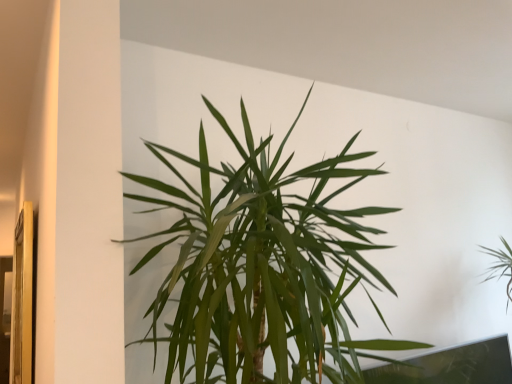
The image size is (512, 384). What are the coordinates of `green leafy plant at upper right, positioned as the first houseplant in back-to-front order` in the screenshot? It's located at (500, 266).

Describe the element at coordinates (500, 266) in the screenshot. Image resolution: width=512 pixels, height=384 pixels. I see `green leafy plant at upper right, the 2th houseplant viewed from the left` at that location.

Describe the element at coordinates (262, 267) in the screenshot. This screenshot has height=384, width=512. I see `green leafy plant at center, arranged as the 2th houseplant when viewed from the right` at that location.

At what (x,y) coordinates should I click in order to perform the action: click on green leafy plant at center, marked as the 1th houseplant in a front-to-back arrangement. Please return your answer as a coordinate pair (x, y). Looking at the image, I should click on (262, 267).

Find the location of `green leafy plant at upper right, the 2th houseplant when ordered from front to back`. green leafy plant at upper right, the 2th houseplant when ordered from front to back is located at coordinates (500, 266).

Would you say green leafy plant at upper right, the 2th houseplant when ordered from front to back, is to the left or to the right of green leafy plant at center, arranged as the 1th houseplant when viewed from the left, in the picture?

green leafy plant at upper right, the 2th houseplant when ordered from front to back, is positioned on green leafy plant at center, arranged as the 1th houseplant when viewed from the left,'s right side.

Is green leafy plant at upper right, the first houseplant in the right-to-left sequence, further to the viewer compared to green leafy plant at center, arranged as the 1th houseplant when viewed from the left?

Yes, it is.

Is point (507, 247) positioned after point (247, 121)?

Yes, it is behind point (247, 121).

In the scene shown: From the image's perspective, does green leafy plant at upper right, the first houseplant in the right-to-left sequence, appear lower than green leafy plant at center, arranged as the 2th houseplant when viewed from the right?

Yes.

From a real-world perspective, is green leafy plant at upper right, the 2th houseplant when ordered from front to back, beneath green leafy plant at center, arranged as the 1th houseplant when viewed from the left?

Yes, from a real-world perspective, green leafy plant at upper right, the 2th houseplant when ordered from front to back, is under green leafy plant at center, arranged as the 1th houseplant when viewed from the left.

Does green leafy plant at upper right, positioned as the first houseplant in back-to-front order, have a lesser width compared to green leafy plant at center, placed as the 2th houseplant when sorted from back to front?

Yes.

Considering the sizes of objects green leafy plant at upper right, the 2th houseplant when ordered from front to back, and green leafy plant at center, placed as the 2th houseplant when sorted from back to front, in the image provided, who is shorter, green leafy plant at upper right, the 2th houseplant when ordered from front to back, or green leafy plant at center, placed as the 2th houseplant when sorted from back to front,?

Standing shorter between the two is green leafy plant at upper right, the 2th houseplant when ordered from front to back.

Which of these two, green leafy plant at upper right, the first houseplant in the right-to-left sequence, or green leafy plant at center, arranged as the 2th houseplant when viewed from the right, is bigger?

Bigger between the two is green leafy plant at center, arranged as the 2th houseplant when viewed from the right.

Looking at this image, choose the correct answer: Is green leafy plant at upper right, the 2th houseplant when ordered from front to back, inside green leafy plant at center, arranged as the 1th houseplant when viewed from the left, or outside it?

green leafy plant at upper right, the 2th houseplant when ordered from front to back, lies outside green leafy plant at center, arranged as the 1th houseplant when viewed from the left.

Is green leafy plant at upper right, the 2th houseplant when ordered from front to back, placed right next to green leafy plant at center, arranged as the 1th houseplant when viewed from the left?

No, green leafy plant at upper right, the 2th houseplant when ordered from front to back, is not next to green leafy plant at center, arranged as the 1th houseplant when viewed from the left.

Consider the image. Is green leafy plant at upper right, the 2th houseplant when ordered from front to back, aimed at green leafy plant at center, arranged as the 2th houseplant when viewed from the right?

No.

How distant is green leafy plant at upper right, the first houseplant in the right-to-left sequence, from green leafy plant at center, arranged as the 1th houseplant when viewed from the left?

A distance of 1.98 meters exists between green leafy plant at upper right, the first houseplant in the right-to-left sequence, and green leafy plant at center, arranged as the 1th houseplant when viewed from the left.

The width and height of the screenshot is (512, 384). What are the coordinates of `houseplant in front of the green leafy plant at upper right, the 2th houseplant viewed from the left` in the screenshot? It's located at (262, 267).

Considering the positions of objects green leafy plant at center, arranged as the 2th houseplant when viewed from the right, and green leafy plant at upper right, the 2th houseplant when ordered from front to back, in the image provided, who is more to the left, green leafy plant at center, arranged as the 2th houseplant when viewed from the right, or green leafy plant at upper right, the 2th houseplant when ordered from front to back,?

Positioned to the left is green leafy plant at center, arranged as the 2th houseplant when viewed from the right.

Between green leafy plant at center, placed as the 2th houseplant when sorted from back to front, and green leafy plant at upper right, the 2th houseplant viewed from the left, which one is positioned behind?

green leafy plant at upper right, the 2th houseplant viewed from the left, is further from the camera.

Which is behind, point (263, 340) or point (507, 256)?

Positioned behind is point (507, 256).

From the image's perspective, which one is positioned lower, green leafy plant at center, arranged as the 2th houseplant when viewed from the right, or green leafy plant at upper right, the 2th houseplant viewed from the left?

green leafy plant at upper right, the 2th houseplant viewed from the left.

From a real-world perspective, which object stands above the other?

In real-world perspective, green leafy plant at center, placed as the 2th houseplant when sorted from back to front, is above.

In the scene shown: Does green leafy plant at center, marked as the 1th houseplant in a front-to-back arrangement, have a greater width compared to green leafy plant at upper right, positioned as the first houseplant in back-to-front order?

Indeed, green leafy plant at center, marked as the 1th houseplant in a front-to-back arrangement, has a greater width compared to green leafy plant at upper right, positioned as the first houseplant in back-to-front order.

In terms of height, does green leafy plant at center, marked as the 1th houseplant in a front-to-back arrangement, look taller or shorter compared to green leafy plant at upper right, the 2th houseplant when ordered from front to back?

green leafy plant at center, marked as the 1th houseplant in a front-to-back arrangement, is taller than green leafy plant at upper right, the 2th houseplant when ordered from front to back.

Who is bigger, green leafy plant at center, marked as the 1th houseplant in a front-to-back arrangement, or green leafy plant at upper right, the 2th houseplant when ordered from front to back?

Bigger between the two is green leafy plant at center, marked as the 1th houseplant in a front-to-back arrangement.

Is green leafy plant at center, arranged as the 2th houseplant when viewed from the right, inside the boundaries of green leafy plant at upper right, the 2th houseplant viewed from the left, or outside?

green leafy plant at center, arranged as the 2th houseplant when viewed from the right, lies outside green leafy plant at upper right, the 2th houseplant viewed from the left.

Is green leafy plant at center, arranged as the 2th houseplant when viewed from the right, not near green leafy plant at upper right, the 2th houseplant when ordered from front to back?

Yes, green leafy plant at center, arranged as the 2th houseplant when viewed from the right, is far from green leafy plant at upper right, the 2th houseplant when ordered from front to back.

Is green leafy plant at center, placed as the 2th houseplant when sorted from back to front, turned away from green leafy plant at upper right, the 2th houseplant when ordered from front to back?

No, green leafy plant at center, placed as the 2th houseplant when sorted from back to front, is not facing the opposite direction of green leafy plant at upper right, the 2th houseplant when ordered from front to back.

How many degrees apart are the facing directions of green leafy plant at center, marked as the 1th houseplant in a front-to-back arrangement, and green leafy plant at upper right, the 2th houseplant viewed from the left?

The facing directions of green leafy plant at center, marked as the 1th houseplant in a front-to-back arrangement, and green leafy plant at upper right, the 2th houseplant viewed from the left, are 2.26 degrees apart.

The height and width of the screenshot is (384, 512). I want to click on houseplant below the green leafy plant at center, arranged as the 1th houseplant when viewed from the left (from a real-world perspective), so click(x=500, y=266).

The width and height of the screenshot is (512, 384). I want to click on houseplant above the green leafy plant at upper right, the first houseplant in the right-to-left sequence (from a real-world perspective), so click(x=262, y=267).

This screenshot has height=384, width=512. I want to click on houseplant on the right of the green leafy plant at center, placed as the 2th houseplant when sorted from back to front, so click(x=500, y=266).